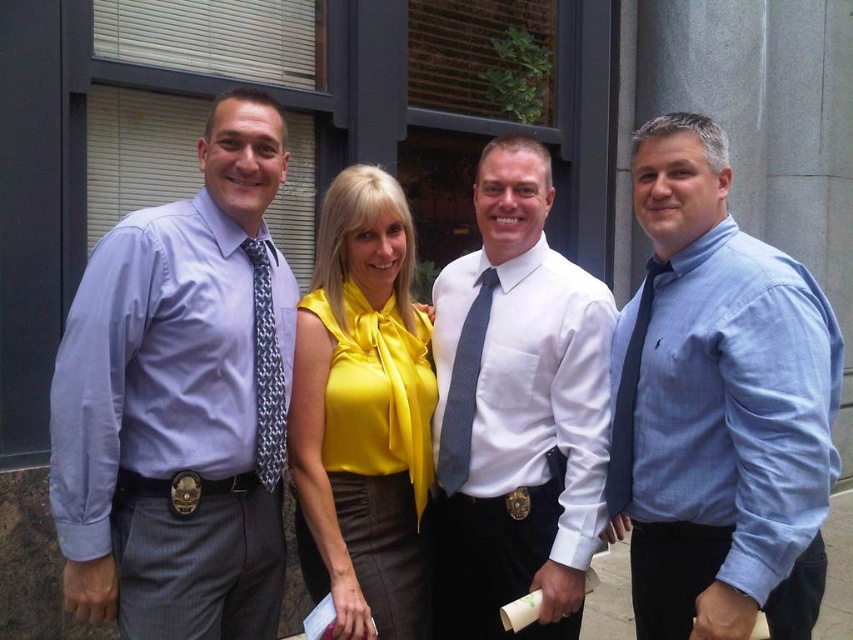
Please provide the 2D coordinates of the blue cotton shirt at right in the image.

The blue cotton shirt at right is located at the 2D coordinates of point (718, 406).

You are a photographer positioned to take a group photo of the matte purple shirt at left and the black silk tie at right. Which person should you ask to move back slightly to ensure both are fully visible in the frame?

The matte purple shirt at left is in front of the black silk tie at right, so you should ask the person wearing the matte purple shirt at left to move back slightly so both can be fully visible in the frame.

You are standing in front of the modern building and notice the matte purple shirt at left. Can you determine its exact coordinates in the scene?

The matte purple shirt at left is located at point (181,403).